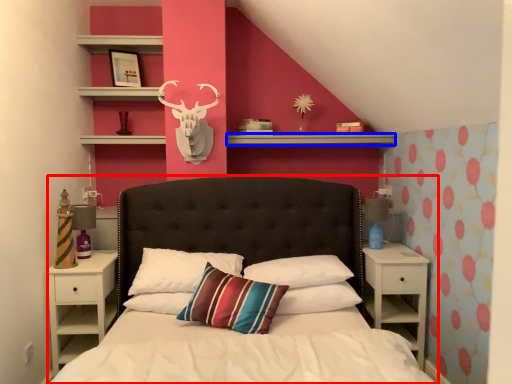
Question: Which object is closer to the camera taking this photo, bed (highlighted by a red box) or mantle (highlighted by a blue box)?

Choices:
 (A) bed
 (B) mantle

Answer: (A)